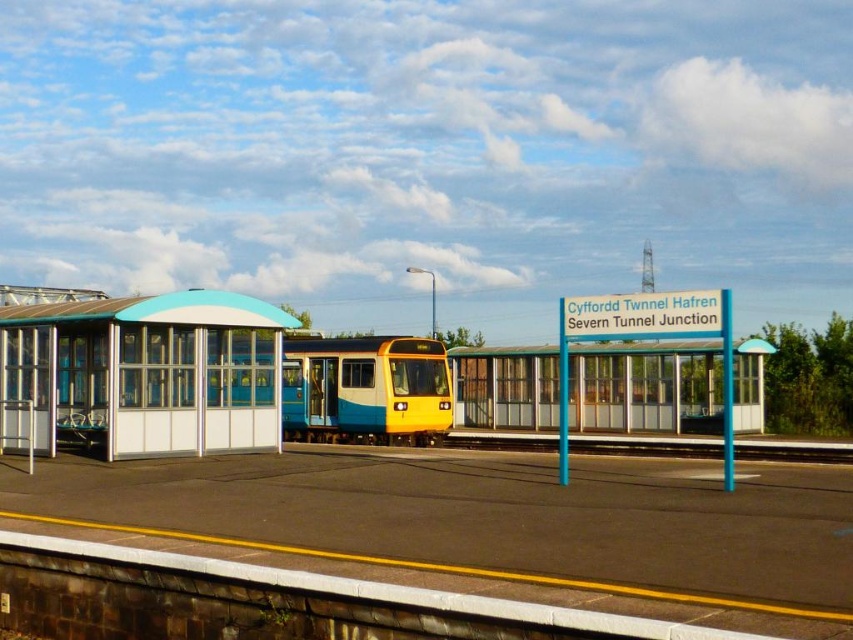
You are a passenger waiting at the railway station. You need to board the yellow matte passenger train at center but first want to check the schedule at the white glass bus station at left. Which object should you approach first to reach the other?

You should first approach the white glass bus station at left because it is closer to you than the yellow matte passenger train at center, so you can check the schedule there before heading to the train.

You are a bus driver who needs to park your bus at the blue glass bus stop at center. The bus is 3 meters wide. Can you safely park your bus there without overlapping the metal train track at center?

The blue glass bus stop at center is narrower than the metal train track at center. Since the bus is 3 meters wide, it may not fit within the bus stop area, which is narrower than the train track. Therefore, parking the bus there could overlap the metal train track at center.

You are standing on the platform at the railway station and want to walk from point (x=289, y=426) to point (x=827, y=442). Which direction should you face to move towards the latter point?

Since point (x=289, y=426) is closer to you than point (x=827, y=442), you should face away from the train towards the signpost to move towards the latter point.